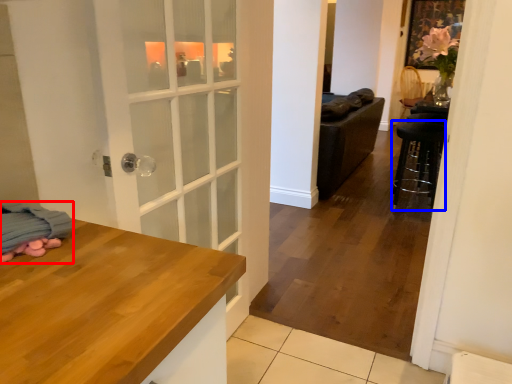
Question: Among these objects, which one is nearest to the camera, blanket (highlighted by a red box) or bar stool (highlighted by a blue box)?

Choices:
 (A) blanket
 (B) bar stool

Answer: (A)